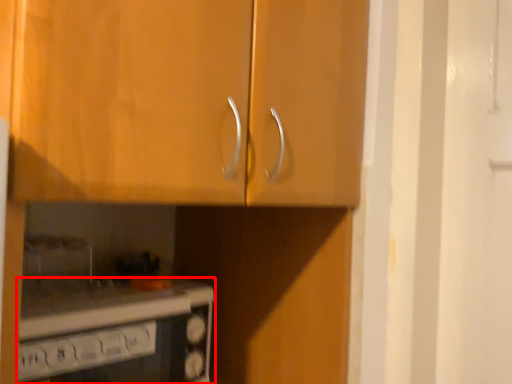
Question: Considering the relative positions of home appliance (annotated by the red box) and cabinetry in the image provided, where is home appliance (annotated by the red box) located with respect to the staircase?

Choices:
 (A) left
 (B) right

Answer: (A)